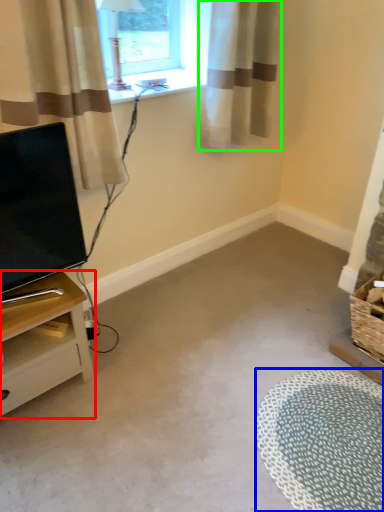
Question: Based on their relative distances, which object is farther from nightstand (highlighted by a red box)? Choose from flat (highlighted by a blue box) and curtain (highlighted by a green box).

Choices:
 (A) flat
 (B) curtain

Answer: (B)